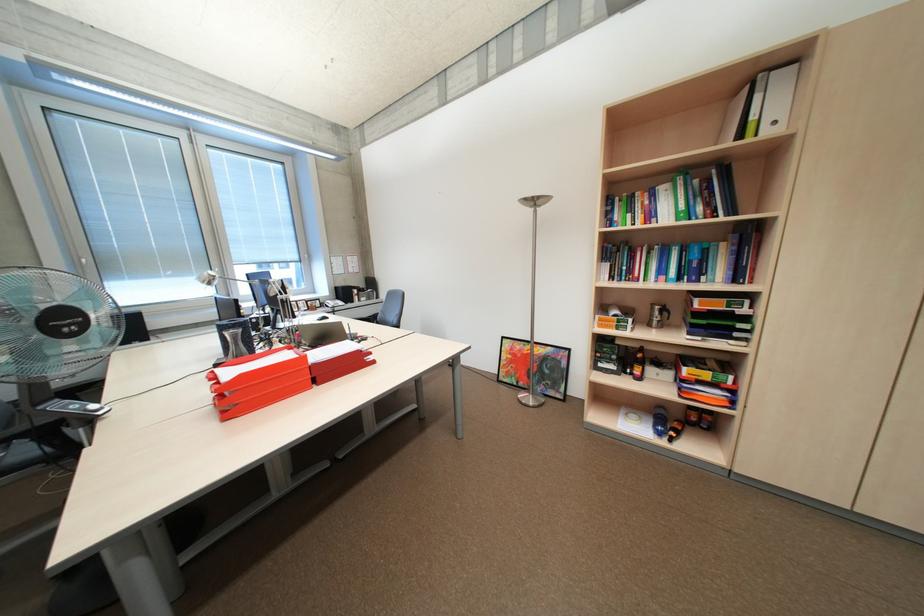
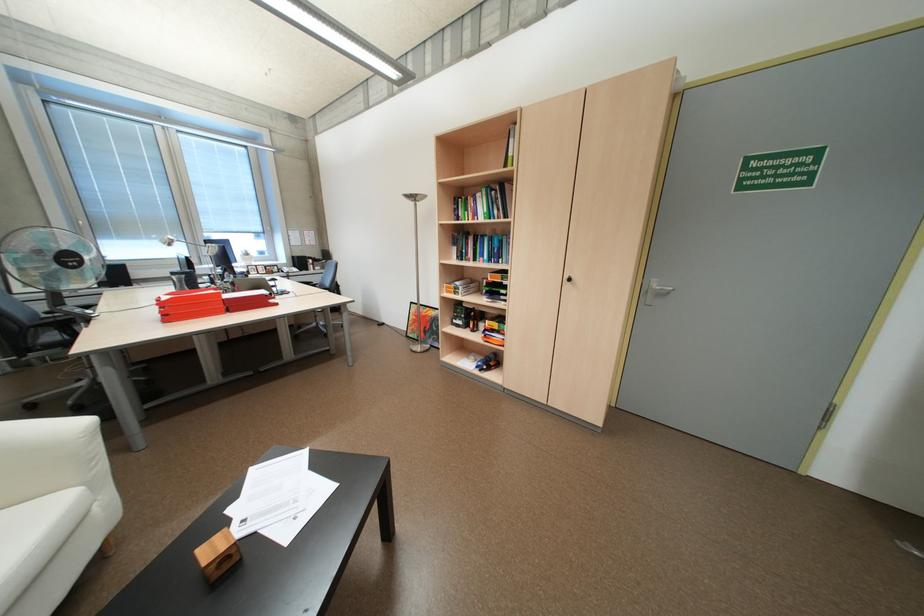
Where in the second image is the point corresponding to pixel 627 328 from the first image?

(465, 293)